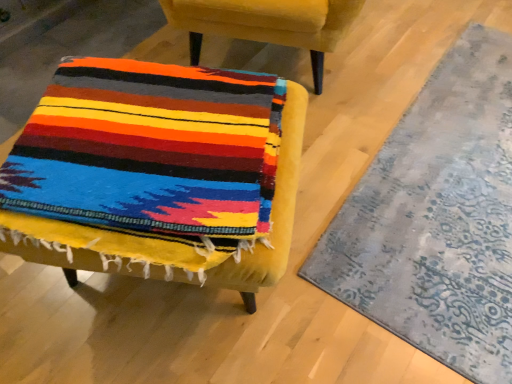
Question: Is velvet yellow chair at lower left, the 2th chair in the bottom-to-top sequence, spatially inside velvet yellow chair at center, marked as the 1th chair in a bottom-to-top arrangement, or outside of it?

Choices:
 (A) inside
 (B) outside

Answer: (B)

Question: From a real-world perspective, is velvet yellow chair at lower left, the 2th chair in the bottom-to-top sequence, above or below velvet yellow chair at center, marked as the 1th chair in a bottom-to-top arrangement?

Choices:
 (A) below
 (B) above

Answer: (B)

Question: Which object is positioned closest to the textured gray rug at lower right?

Choices:
 (A) velvet yellow chair at lower left, the 2th chair in the bottom-to-top sequence
 (B) velvet yellow chair at center, arranged as the second chair when viewed from the top

Answer: (B)

Question: Which of these objects is positioned closest to the textured gray rug at lower right?

Choices:
 (A) velvet yellow chair at center, arranged as the second chair when viewed from the top
 (B) velvet yellow chair at lower left, the 2th chair in the bottom-to-top sequence

Answer: (A)